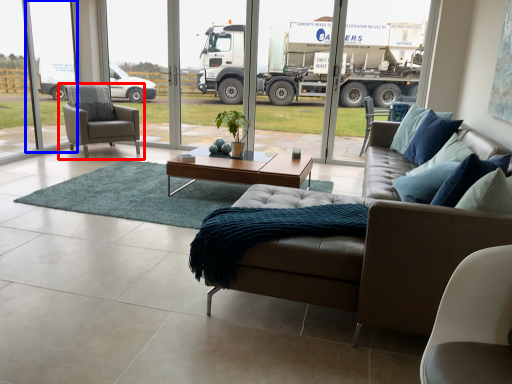
Question: Which point is further to the camera, chair (highlighted by a red box) or window screen (highlighted by a blue box)?

Choices:
 (A) chair
 (B) window screen

Answer: (A)